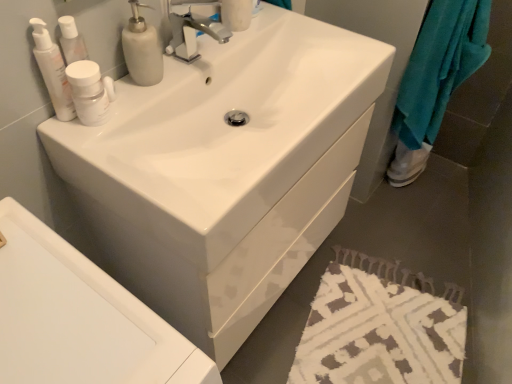
At what (x,y) coordinates should I click in order to perform the action: click on vacant point above white textured bath mat at lower right (from a real-world perspective). Please return your answer as a coordinate pair (x, y). The image size is (512, 384). Looking at the image, I should click on (381, 321).